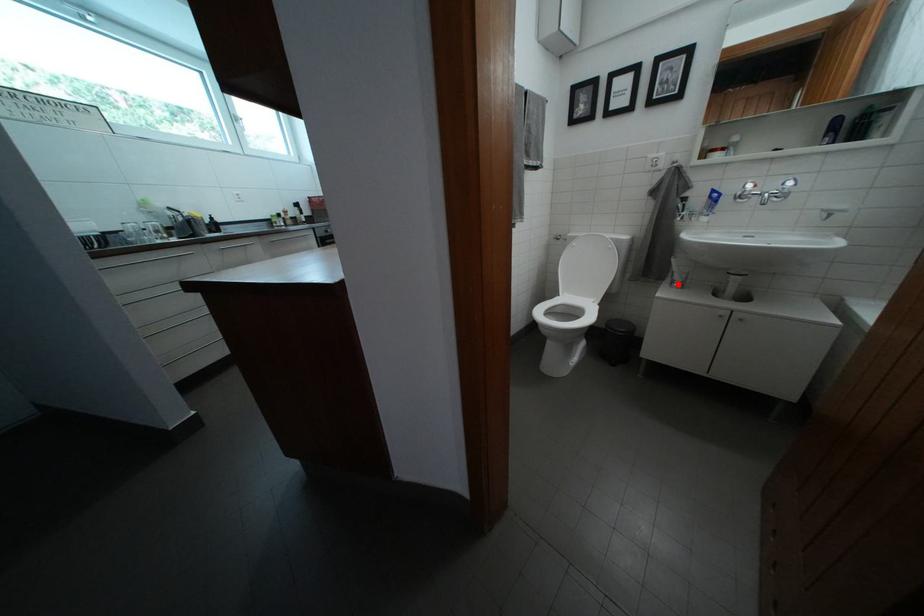
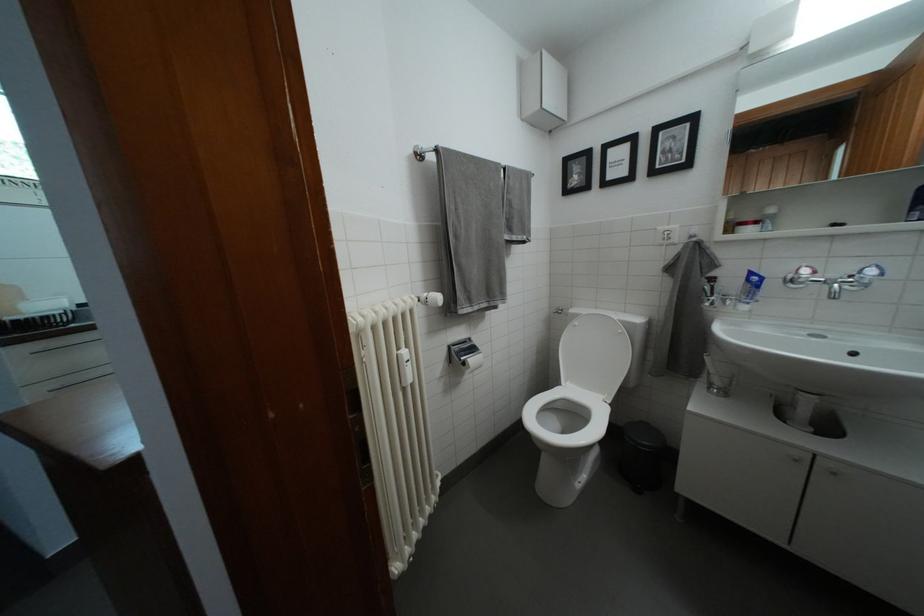
Question: I am providing you with two images of the same scene from different viewpoints. In image1, a red point is highlighted. Considering the same 3D point in image2, which of the following is correct?

Choices:
 (A) It is closer
 (B) It is farther

Answer: (B)